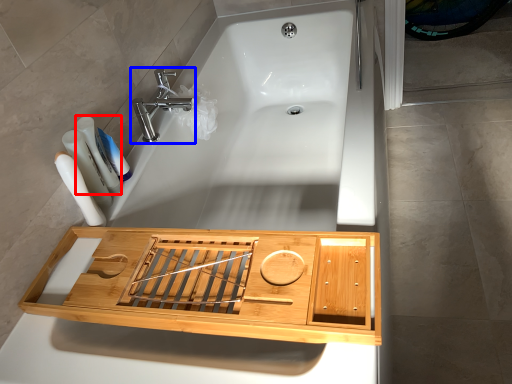
Question: Which object appears closest to the camera in this image, toiletry (highlighted by a red box) or tap (highlighted by a blue box)?

Choices:
 (A) toiletry
 (B) tap

Answer: (A)